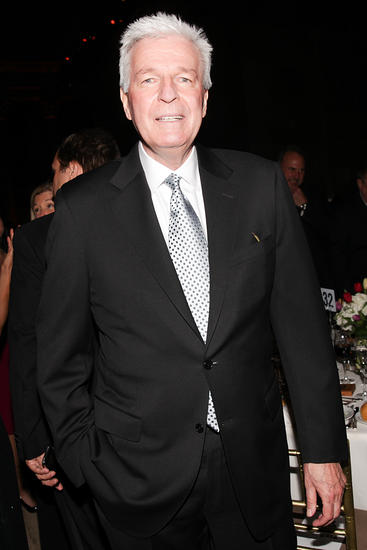
Identify the location of chair. The image size is (367, 550). (346, 521).